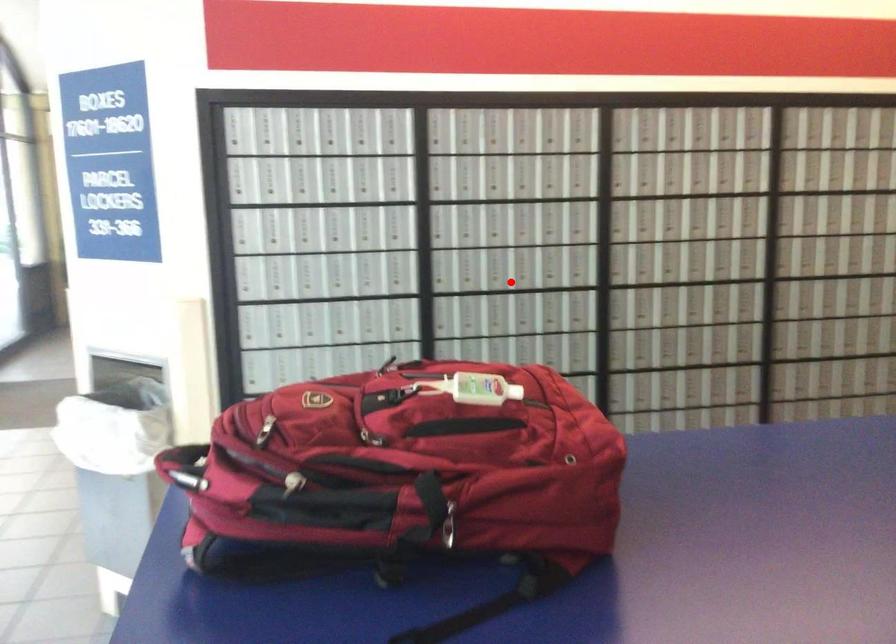
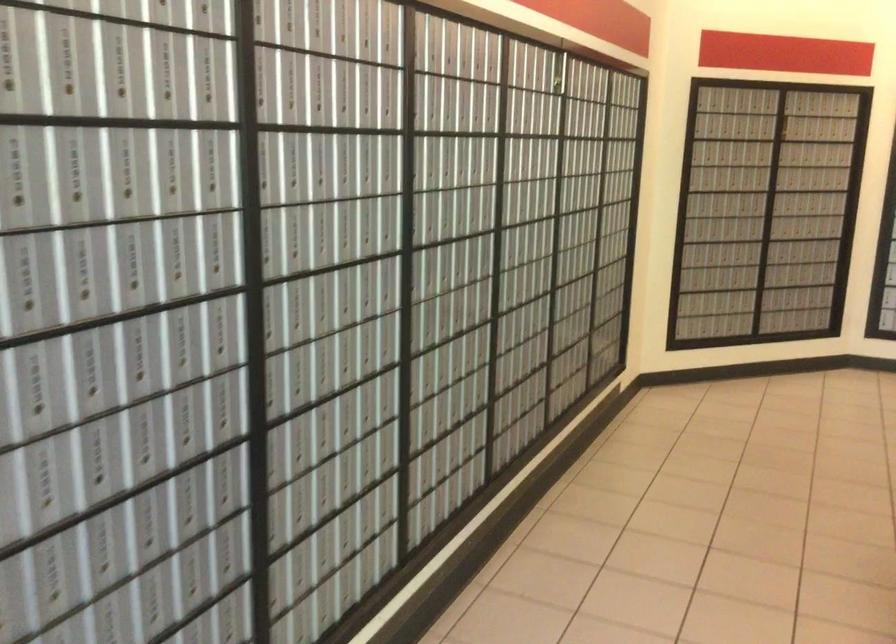
Locate, in the second image, the point that corresponds to the highlighted location in the first image.

(329, 252)